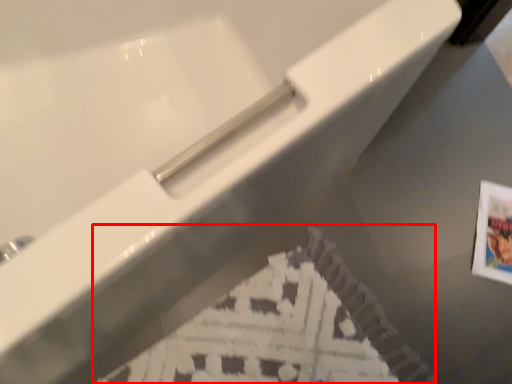
Question: Where is flyer (annotated by the red box) located in relation to postcard in the image?

Choices:
 (A) left
 (B) right

Answer: (A)